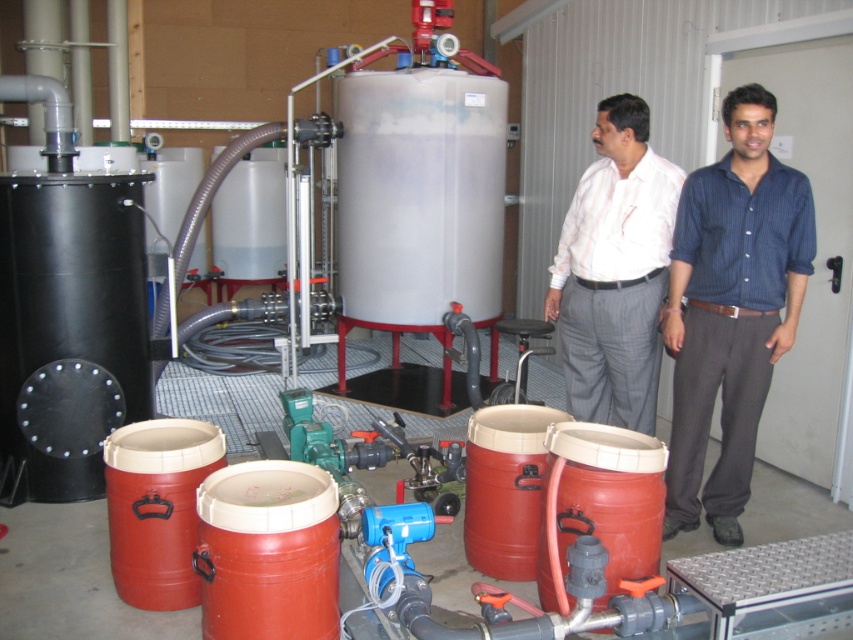
Between blue striped shirt at right and white striped shirt at center, which one appears on the left side from the viewer's perspective?

white striped shirt at center

Is point (735, 406) positioned behind point (634, 109)?

No.

Is point (714, 266) less distant than point (645, 321)?

Yes, point (714, 266) is in front of point (645, 321).

You are a GUI agent. You are given a task and a screenshot of the screen. Output one action in this format:
    pyautogui.click(x=<x>, y=<y>)
    Task: Click on the blue striped shirt at right
    
    Given the screenshot: What is the action you would take?
    pyautogui.click(x=730, y=308)